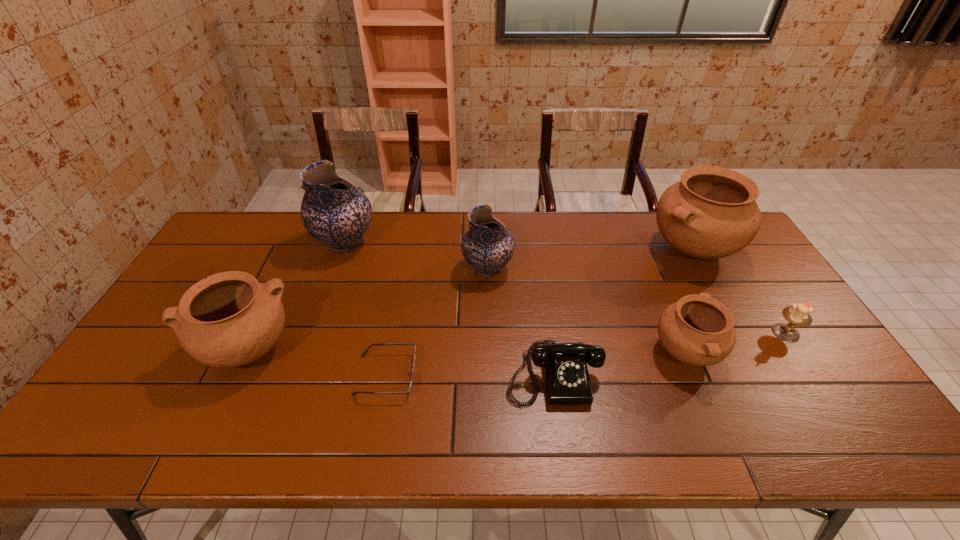
You are a GUI agent. You are given a task and a screenshot of the screen. Output one action in this format:
    pyautogui.click(x=<x>, y=<y>)
    Task: Click on the bigger blue pottery
    
    Given the screenshot: What is the action you would take?
    pyautogui.click(x=335, y=213)

Locate an element on the screen. Image resolution: width=960 pixels, height=540 pixels. the farthest terracotta pottery is located at coordinates (711, 213).

At what (x,y) coordinates should I click in order to perform the action: click on the third pottery from left to right. Please return your answer as a coordinate pair (x, y). The image size is (960, 540). Looking at the image, I should click on (488, 245).

This screenshot has width=960, height=540. I want to click on the smaller blue pottery, so click(x=488, y=245).

What are the coordinates of `the second smallest terracotta pottery` in the screenshot? It's located at [x=229, y=319].

You are a GUI agent. You are given a task and a screenshot of the screen. Output one action in this format:
    pyautogui.click(x=<x>, y=<y>)
    Task: Click on the smallest terracotta pottery
    Image resolution: width=960 pixels, height=540 pixels.
    Given the screenshot: What is the action you would take?
    pyautogui.click(x=697, y=330)

Where is `candle holder`? The image size is (960, 540). candle holder is located at coordinates (798, 314).

Locate an element on the screen. Image resolution: width=960 pixels, height=540 pixels. black telephone is located at coordinates (567, 381).

What are the coordinates of `telephone` in the screenshot? It's located at (567, 381).

I want to click on the shortest object, so click(x=363, y=355).